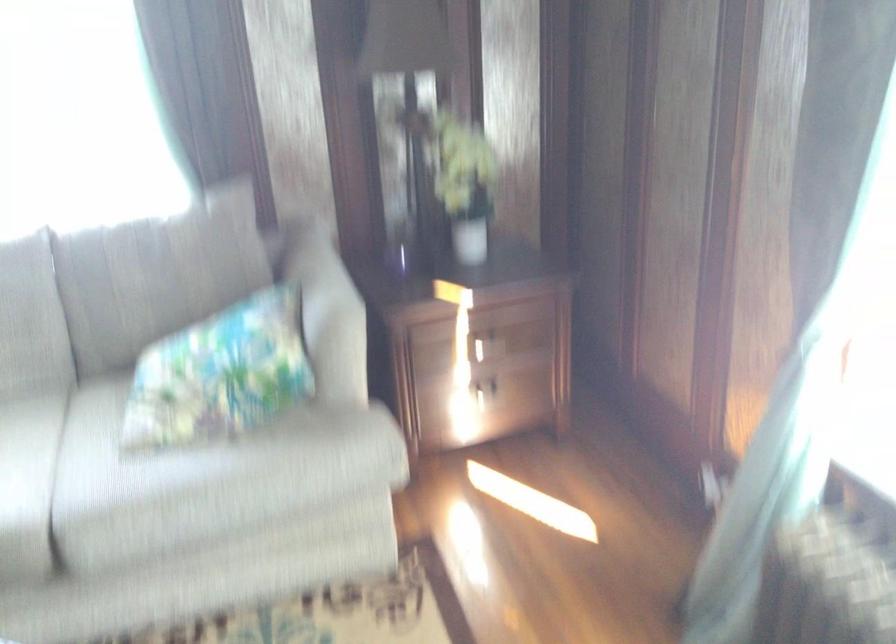
The width and height of the screenshot is (896, 644). In order to click on sofa sitting surface in this screenshot , I will do `click(88, 448)`.